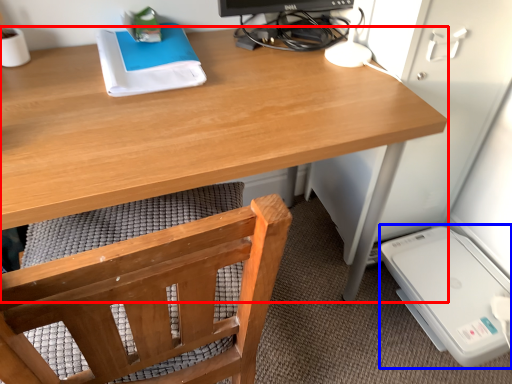
Question: Among these objects, which one is farthest to the camera, desk (highlighted by a red box) or appliance (highlighted by a blue box)?

Choices:
 (A) desk
 (B) appliance

Answer: (B)